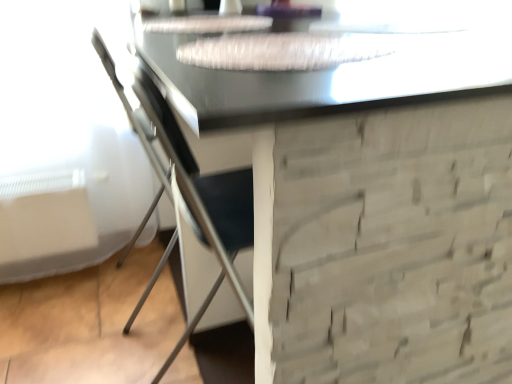
Image resolution: width=512 pixels, height=384 pixels. What are the coordinates of `metallic silver swivel chair at center` in the screenshot? It's located at (189, 188).

The image size is (512, 384). Describe the element at coordinates (189, 188) in the screenshot. I see `metallic silver swivel chair at center` at that location.

This screenshot has height=384, width=512. I want to click on metallic silver swivel chair at center, so click(x=189, y=188).